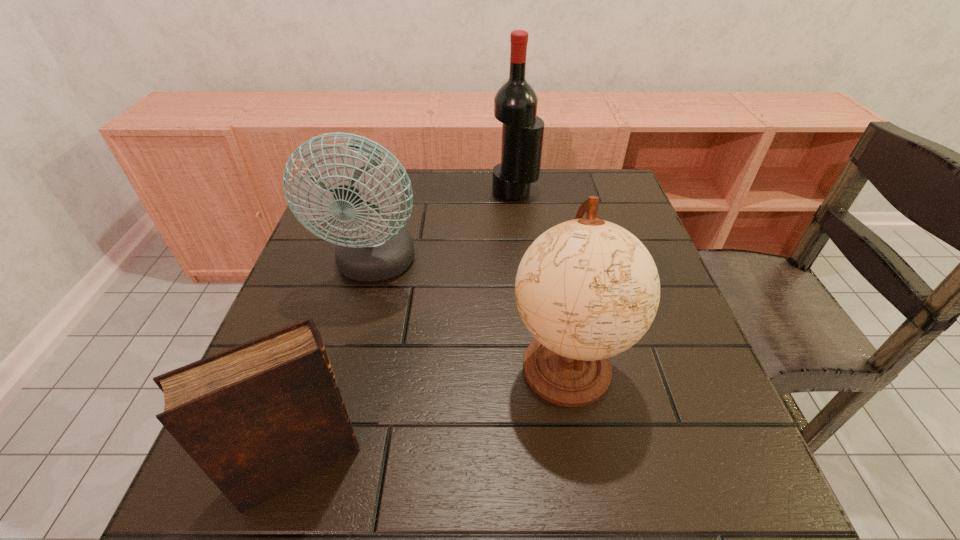
I want to click on free spot at the far right corner of the desktop, so click(599, 185).

Where is `free space at the near right corner of the desktop`? Image resolution: width=960 pixels, height=540 pixels. free space at the near right corner of the desktop is located at coordinates (681, 514).

Identify the location of vacant area between the globe and the second farthest object. The height and width of the screenshot is (540, 960). (470, 316).

Image resolution: width=960 pixels, height=540 pixels. In order to click on vacant space that's between the shortest object and the globe in this screenshot , I will do [433, 415].

Image resolution: width=960 pixels, height=540 pixels. I want to click on blank region between the fan and the globe, so click(x=470, y=316).

The height and width of the screenshot is (540, 960). I want to click on unoccupied position between the third nearest object and the globe, so click(x=470, y=316).

Image resolution: width=960 pixels, height=540 pixels. What are the coordinates of `free space between the wine bottle and the second farthest object` in the screenshot? It's located at (444, 229).

Locate an element on the screen. Image resolution: width=960 pixels, height=540 pixels. the closest object relative to the globe is located at coordinates (370, 249).

Locate which object ranks third in proximity to the shortest object. Please provide its 2D coordinates. Your answer should be formatted as a tuple, i.e. [(x, y)], where the tuple contains the x and y coordinates of a point satisfying the conditions above.

[(515, 104)]